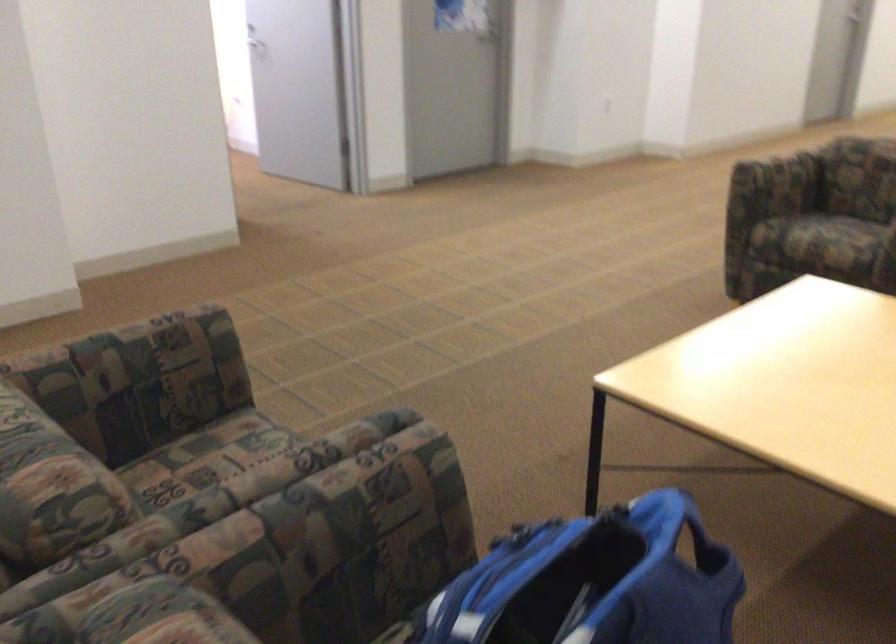
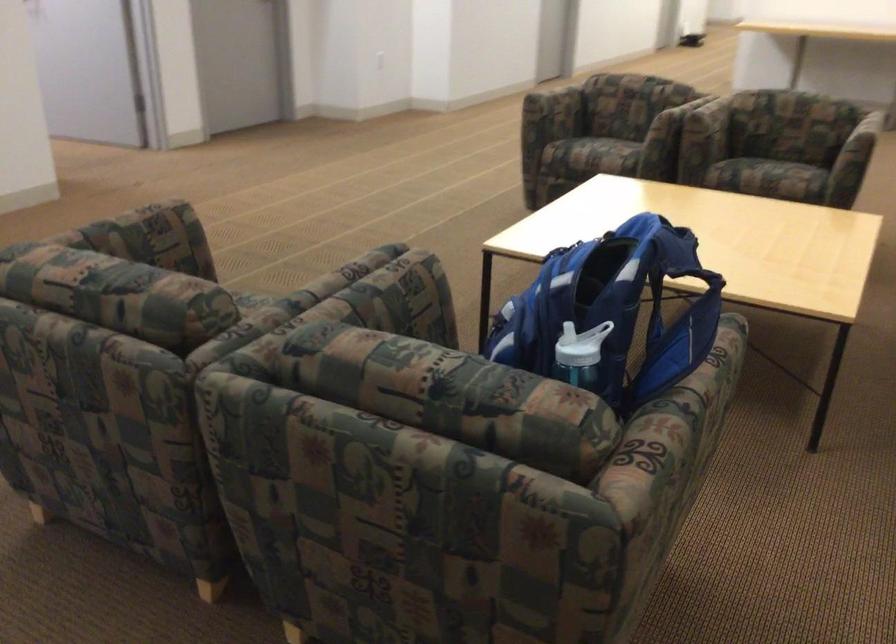
Question: The images are taken continuously from a first-person perspective. In which direction is your viewpoint rotating?

Choices:
 (A) Left
 (B) Right
 (C) Up
 (D) Down

Answer: (B)